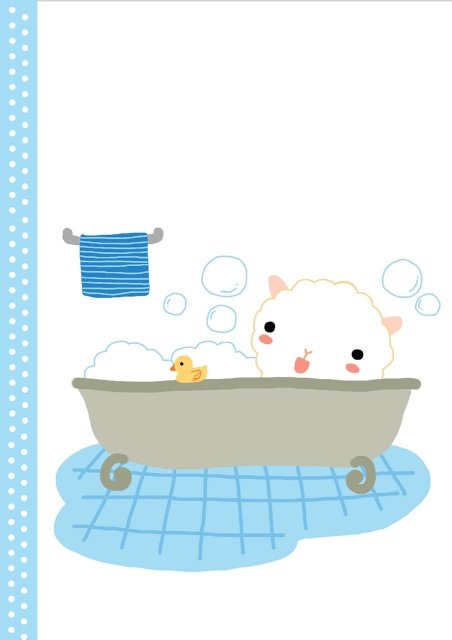
You are a photographer trying to capture a clear photo of the yellow rubber duck at center and the fluffy white lamb at center in the bathtub. Which object might be partially obscured in the photo and why?

The yellow rubber duck at center might be partially obscured because it is positioned behind the fluffy white lamb at center, which could block part of the duck from view.

You are standing in the bathroom looking at the smooth beige bathtub at center and the fluffy white lamb at center. Which object is positioned to the left?

The smooth beige bathtub at center is to the left of the fluffy white lamb at center.